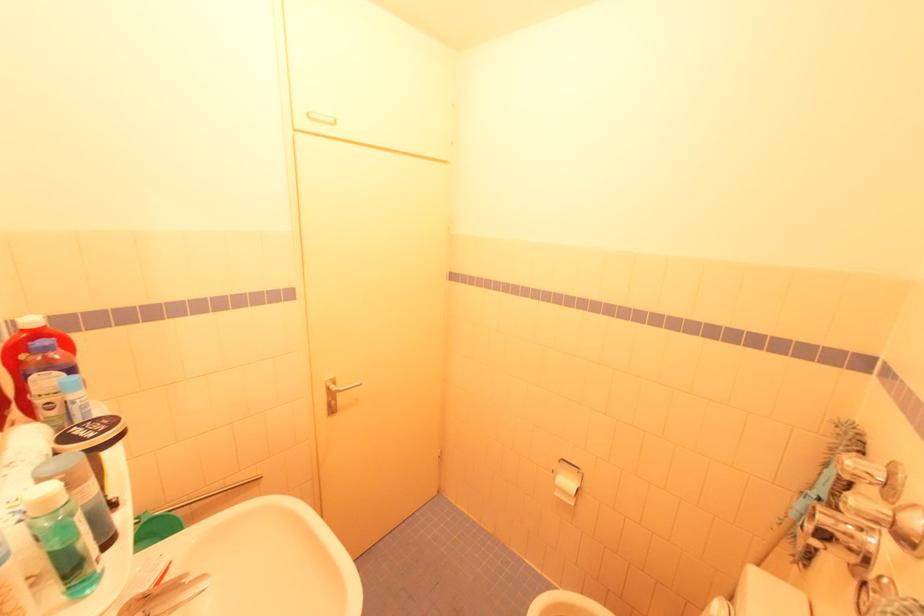
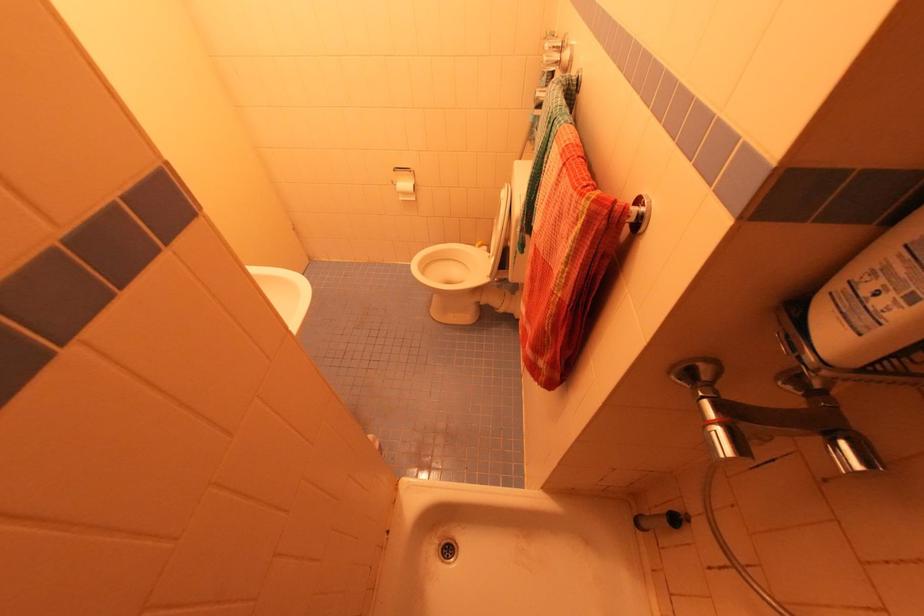
The point at (557, 495) is marked in the first image. Where is the corresponding point in the second image?

(403, 200)